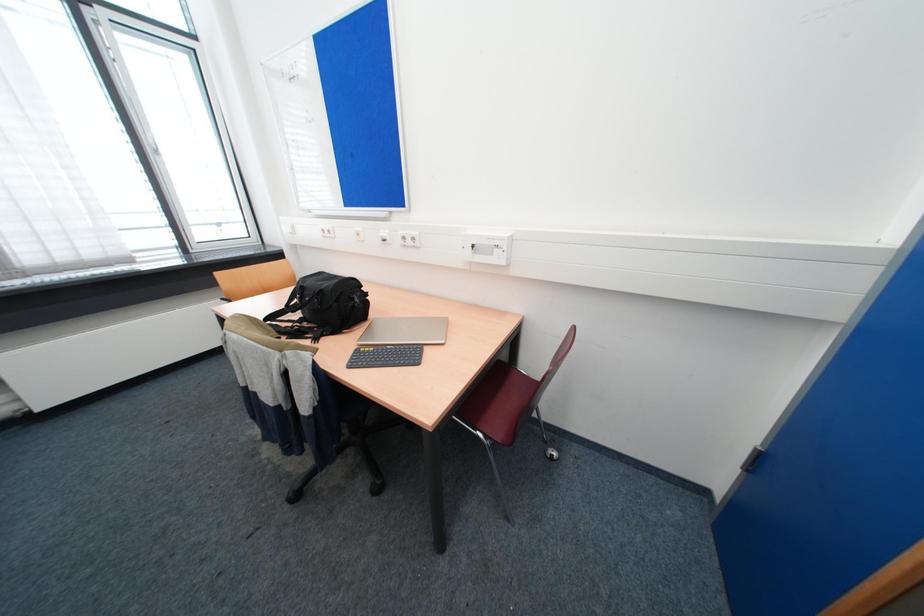
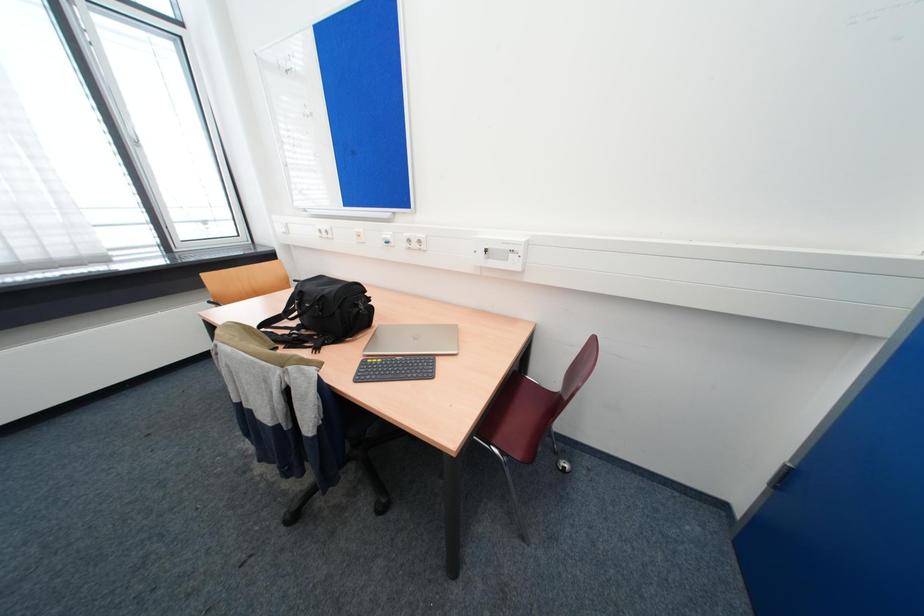
Question: How did the camera likely rotate?

Choices:
 (A) Left
 (B) Right
 (C) Up
 (D) Down

Answer: (B)